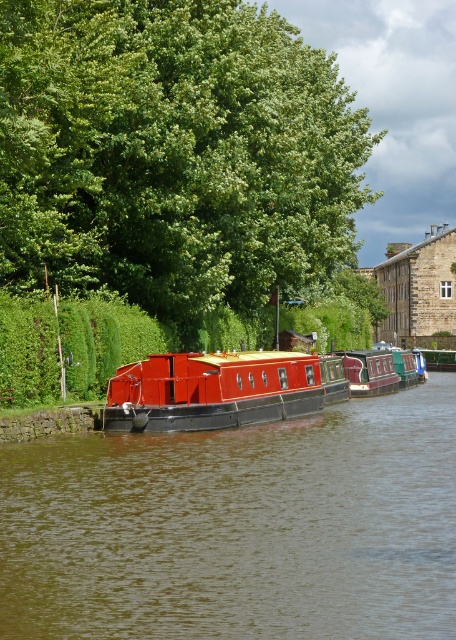
Question: Which object is positioned closest to the green leafy tree at upper center?

Choices:
 (A) metallic red barge at center
 (B) smooth red boat at center

Answer: (A)

Question: Can you confirm if smooth red boat at center is smaller than metallic red barge at center?

Choices:
 (A) yes
 (B) no

Answer: (A)

Question: Can you confirm if smooth red boat at center is positioned above metallic red barge at center?

Choices:
 (A) no
 (B) yes

Answer: (A)

Question: Does smooth red boat at center have a greater width compared to metallic red barge at center?

Choices:
 (A) no
 (B) yes

Answer: (B)

Question: Which object appears farthest from the camera in this image?

Choices:
 (A) metallic red barge at center
 (B) green leafy tree at upper center

Answer: (A)

Question: Which of these objects is positioned closest to the metallic red barge at center?

Choices:
 (A) smooth red boat at center
 (B) green leafy tree at upper center

Answer: (A)